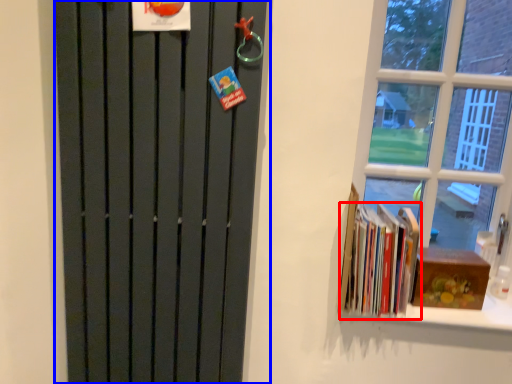
Question: Which of the following is the farthest to the observer, book (highlighted by a red box) or door (highlighted by a blue box)?

Choices:
 (A) book
 (B) door

Answer: (A)